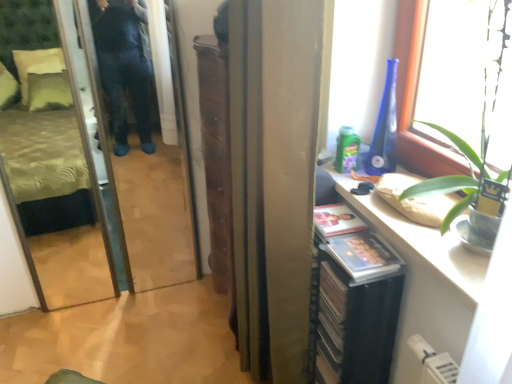
Where is `free point in front of transparent glass screen door at left`? This screenshot has height=384, width=512. free point in front of transparent glass screen door at left is located at coordinates (118, 338).